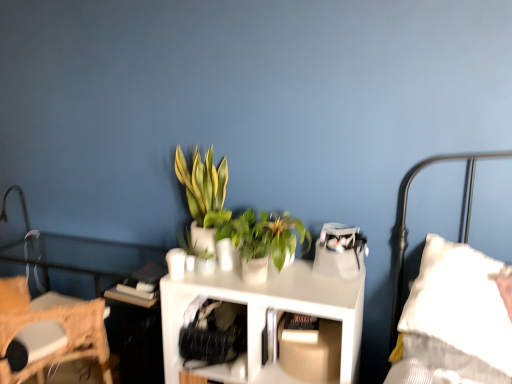
Question: Considering the relative sizes of metallic silver table lamp at left and green matte plant at center, which is counted as the 1th houseplant, starting from the right, in the image provided, is metallic silver table lamp at left smaller than green matte plant at center, which is counted as the 1th houseplant, starting from the right,?

Choices:
 (A) no
 (B) yes

Answer: (B)

Question: Does metallic silver table lamp at left appear on the right side of green matte plant at center, which is counted as the 1th houseplant, starting from the right?

Choices:
 (A) yes
 (B) no

Answer: (B)

Question: Considering the relative sizes of metallic silver table lamp at left and green matte plant at center, which is counted as the 1th houseplant, starting from the right, in the image provided, is metallic silver table lamp at left shorter than green matte plant at center, which is counted as the 1th houseplant, starting from the right,?

Choices:
 (A) yes
 (B) no

Answer: (B)

Question: From a real-world perspective, is metallic silver table lamp at left located higher than green matte plant at center, which is counted as the 1th houseplant, starting from the right?

Choices:
 (A) yes
 (B) no

Answer: (B)

Question: Is green matte plant at center, which ranks as the second houseplant in left-to-right order, inside metallic silver table lamp at left?

Choices:
 (A) no
 (B) yes

Answer: (A)

Question: Is metallic silver table lamp at left closer to the viewer compared to green matte plant at center, which ranks as the second houseplant in left-to-right order?

Choices:
 (A) no
 (B) yes

Answer: (A)

Question: From a real-world perspective, is white matte table at center physically above green leafy plant at center, arranged as the 2th houseplant when viewed from the right?

Choices:
 (A) no
 (B) yes

Answer: (A)

Question: From the image's perspective, is white matte table at center beneath green leafy plant at center, arranged as the 2th houseplant when viewed from the right?

Choices:
 (A) yes
 (B) no

Answer: (A)

Question: Are white matte table at center and green leafy plant at center, arranged as the 2th houseplant when viewed from the right, far apart?

Choices:
 (A) no
 (B) yes

Answer: (A)

Question: Considering the relative sizes of white matte table at center and green leafy plant at center, which appears as the first houseplant when viewed from the left, in the image provided, is white matte table at center taller than green leafy plant at center, which appears as the first houseplant when viewed from the left,?

Choices:
 (A) no
 (B) yes

Answer: (B)

Question: Considering the relative sizes of white matte table at center and green leafy plant at center, which appears as the first houseplant when viewed from the left, in the image provided, is white matte table at center thinner than green leafy plant at center, which appears as the first houseplant when viewed from the left,?

Choices:
 (A) yes
 (B) no

Answer: (B)

Question: Is green leafy plant at center, which appears as the first houseplant when viewed from the left, a part of white matte table at center?

Choices:
 (A) no
 (B) yes

Answer: (A)

Question: Is white matte table at center further to camera compared to metallic silver table lamp at left?

Choices:
 (A) yes
 (B) no

Answer: (B)